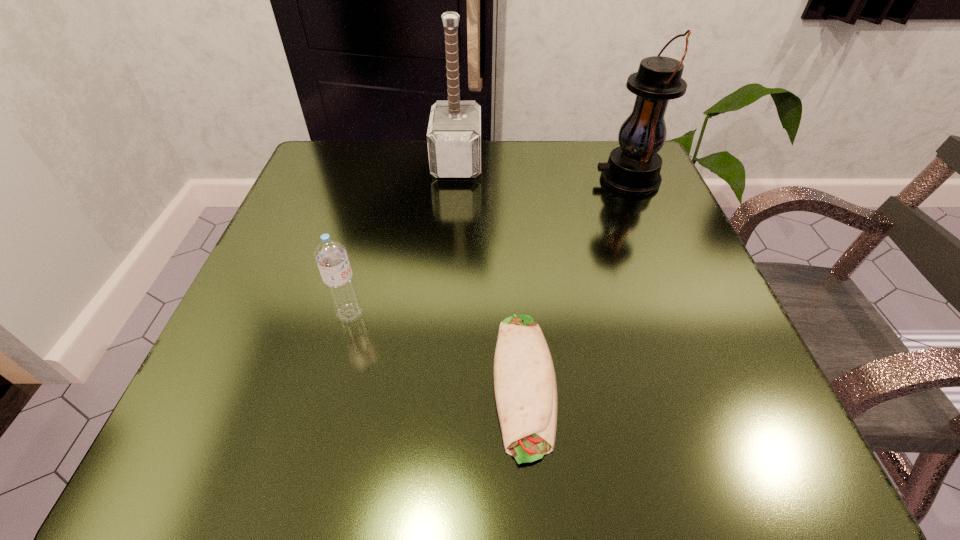
Find the location of `vacant space located 0.340m on the back of the water bottle`. vacant space located 0.340m on the back of the water bottle is located at coordinates [384, 183].

Where is `hammer at the far edge`? The image size is (960, 540). hammer at the far edge is located at coordinates (454, 132).

At what (x,y) coordinates should I click in order to perform the action: click on lantern that is at the far edge. Please return your answer as a coordinate pair (x, y). This screenshot has height=540, width=960. Looking at the image, I should click on (633, 168).

What are the coordinates of `object that is at the near edge` in the screenshot? It's located at 525,386.

Locate an element on the screen. object positioned at the left edge is located at coordinates (330, 255).

Where is `object situated at the right edge`? The height and width of the screenshot is (540, 960). object situated at the right edge is located at coordinates (633, 168).

The width and height of the screenshot is (960, 540). I want to click on object located in the far right corner section of the desktop, so click(x=633, y=168).

The width and height of the screenshot is (960, 540). In order to click on free region at the far edge of the desktop in this screenshot , I will do `click(548, 200)`.

This screenshot has width=960, height=540. In the image, there is a desktop. What are the coordinates of `vacant space at the left edge` in the screenshot? It's located at (340, 226).

In order to click on vacant space at the right edge of the desktop in this screenshot , I will do `click(639, 289)`.